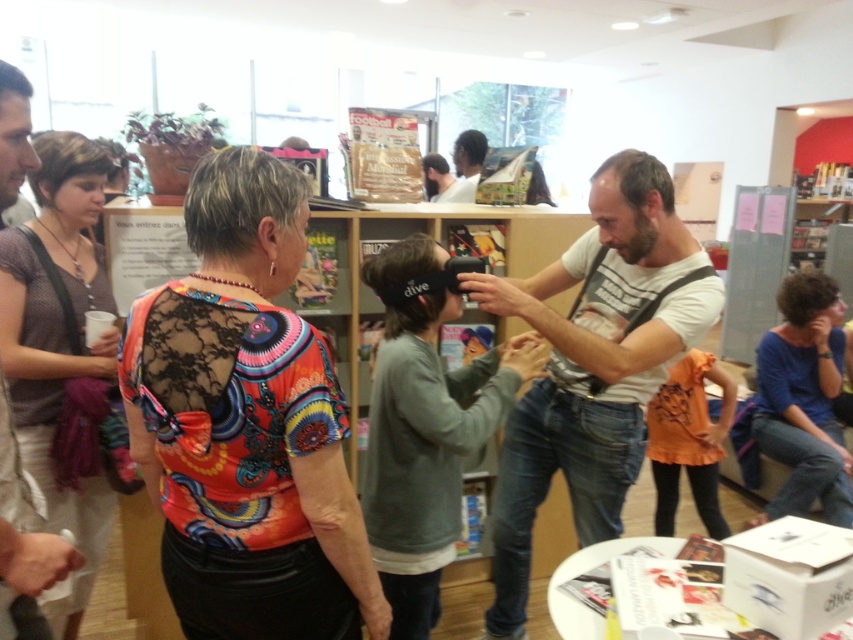
Question: Which point is closer to the camera taking this photo?

Choices:
 (A) (467, 188)
 (B) (436, 188)

Answer: (A)

Question: Which is nearer to the multicolored lace top at center?

Choices:
 (A) matte white shirt at upper center
 (B) blue cotton shirt at lower right
 (C) matte white shirt at center

Answer: (B)

Question: Is dark gray sweater at center bigger than blue cotton shirt at lower right?

Choices:
 (A) yes
 (B) no

Answer: (B)

Question: Is matte gray shirt at center bigger than dark gray sweater at center?

Choices:
 (A) no
 (B) yes

Answer: (B)

Question: Among these points, which one is nearest to the camera?

Choices:
 (A) pos(495,620)
 (B) pos(838,368)

Answer: (A)

Question: Can you confirm if white cotton t-shirt at center is positioned to the left of matte white shirt at upper center?

Choices:
 (A) no
 (B) yes

Answer: (A)